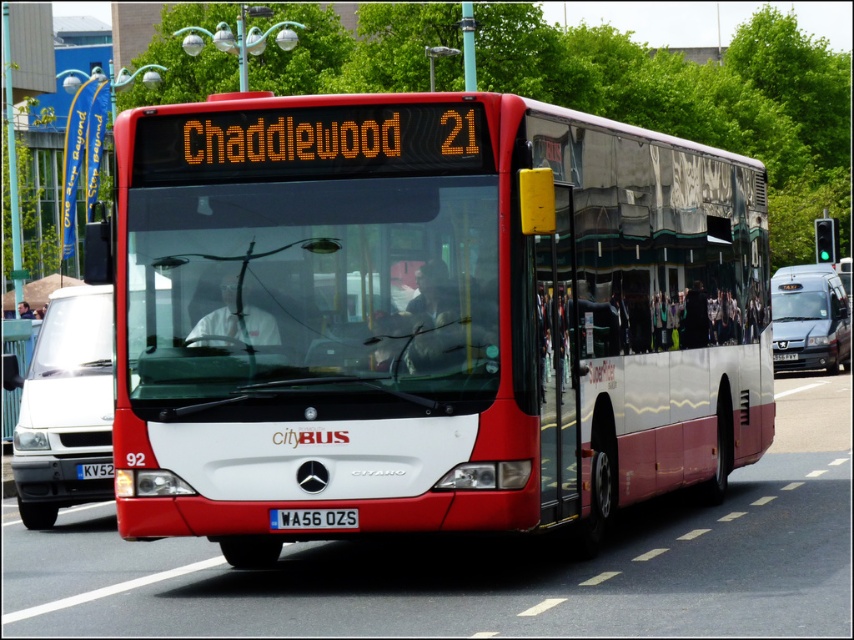
Question: Among these points, which one is nearest to the camera?

Choices:
 (A) (83, 472)
 (B) (294, 528)
 (C) (774, 323)
 (D) (190, 497)

Answer: (B)

Question: Is metallic silver van at center to the left of white metallic license plate at center from the viewer's perspective?

Choices:
 (A) no
 (B) yes

Answer: (A)

Question: Does metallic silver van at center have a lesser width compared to blue metallic license plate at center?

Choices:
 (A) yes
 (B) no

Answer: (B)

Question: Which object appears closest to the camera in this image?

Choices:
 (A) shiny red bus at center
 (B) metallic silver van at center

Answer: (A)

Question: Which object is farther from the camera taking this photo?

Choices:
 (A) white matte van at left
 (B) metallic silver van at center
 (C) white metallic license plate at center

Answer: (B)

Question: Can you confirm if shiny red bus at center is bigger than white matte van at left?

Choices:
 (A) yes
 (B) no

Answer: (B)